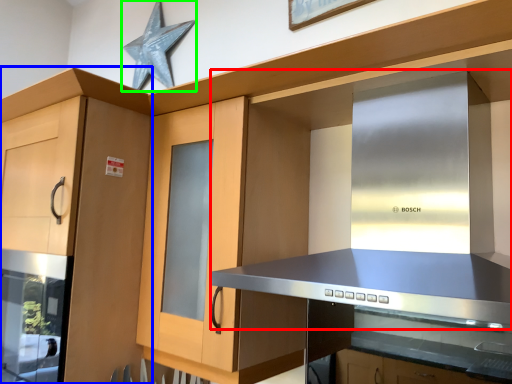
Question: Estimate the real-world distances between objects in this image. Which object is closer to vent (highlighted by a red box), cabinetry (highlighted by a blue box) or star (highlighted by a green box)?

Choices:
 (A) cabinetry
 (B) star

Answer: (A)